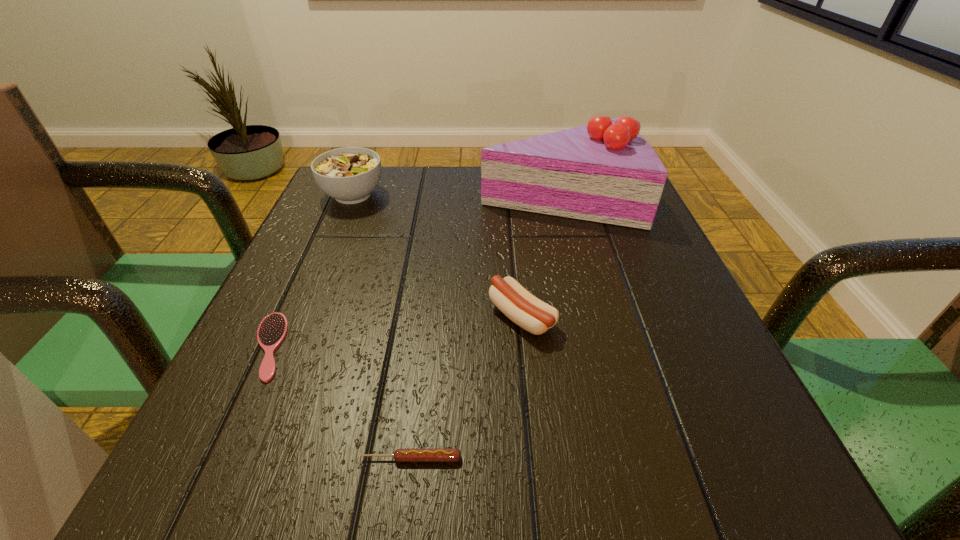
You are a GUI agent. You are given a task and a screenshot of the screen. Output one action in this format:
    pyautogui.click(x=<x>, y=<y>)
    Task: Click on the tallest object
    The width and height of the screenshot is (960, 540).
    Given the screenshot: What is the action you would take?
    pyautogui.click(x=606, y=172)

You are a GUI agent. You are given a task and a screenshot of the screen. Output one action in this format:
    pyautogui.click(x=<x>, y=<y>)
    Task: Click on the soup bowl
    
    Given the screenshot: What is the action you would take?
    pyautogui.click(x=349, y=175)

This screenshot has width=960, height=540. I want to click on the farther sausage, so click(x=527, y=311).

The image size is (960, 540). In order to click on the third tallest object in this screenshot , I will do `click(527, 311)`.

The height and width of the screenshot is (540, 960). What are the coordinates of `hairbrush` in the screenshot? It's located at (273, 329).

The image size is (960, 540). What are the coordinates of `the left sausage` in the screenshot? It's located at (402, 454).

Locate an element on the screen. the third object from left to right is located at coordinates (402, 454).

At what (x,y) coordinates should I click in order to perform the action: click on vacant region located 0.160m on the left of the cake. Please return your answer as a coordinate pair (x, y). The height and width of the screenshot is (540, 960). Looking at the image, I should click on (412, 198).

At what (x,y) coordinates should I click in order to perform the action: click on free region located 0.310m on the right of the soup bowl. Please return your answer as a coordinate pair (x, y). This screenshot has width=960, height=540. Looking at the image, I should click on (518, 195).

Where is `vacant point located 0.080m on the front of the right sausage`? The image size is (960, 540). vacant point located 0.080m on the front of the right sausage is located at coordinates (529, 387).